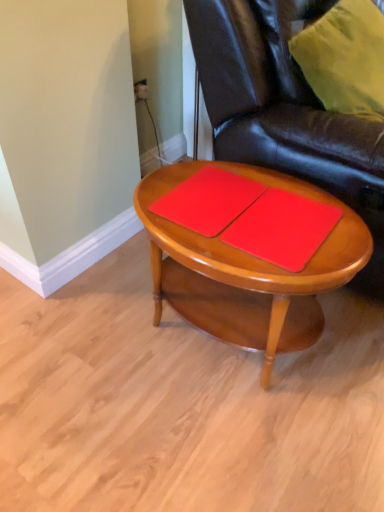
This screenshot has width=384, height=512. I want to click on vacant space situated on the left part of matte wood coffee table at center, so click(84, 344).